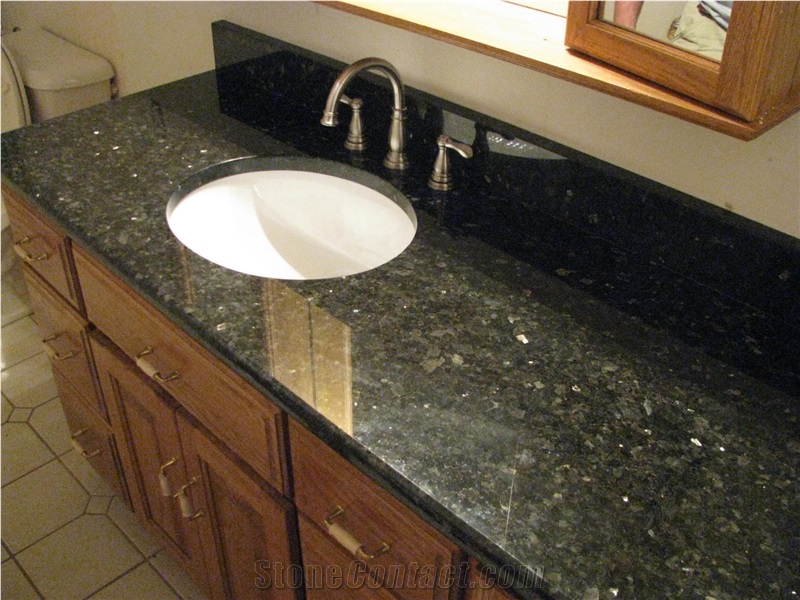
At what (x,y) coordinates should I click in order to perform the action: click on sink. Please return your answer as a coordinate pair (x, y). Looking at the image, I should click on (257, 216).